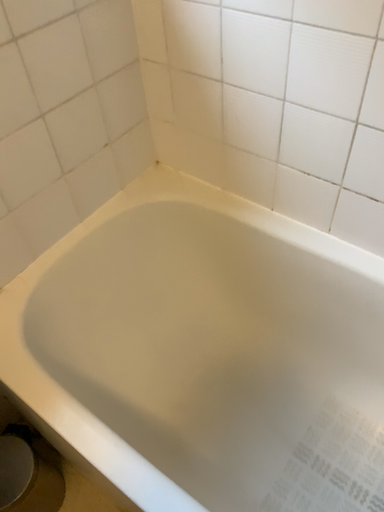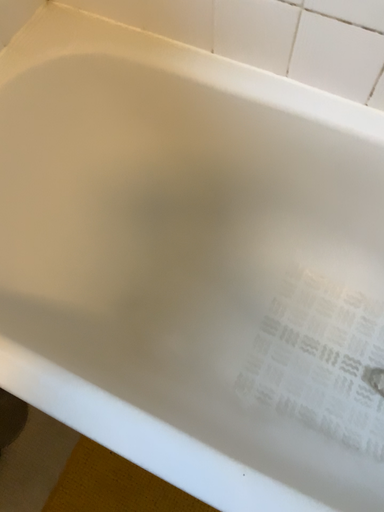
Question: How did the camera likely rotate when shooting the video?

Choices:
 (A) rotated right
 (B) rotated left

Answer: (A)